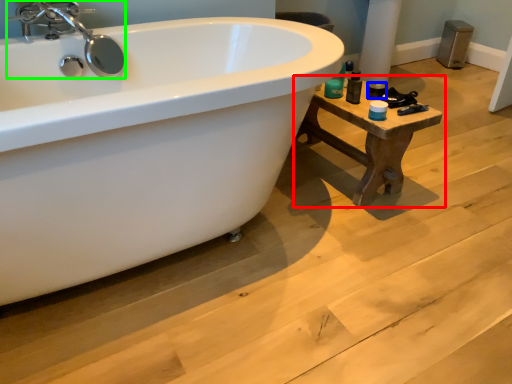
Question: Considering the real-world distances, which object is farthest from table (highlighted by a red box)? toiletry (highlighted by a blue box) or tap (highlighted by a green box)?

Choices:
 (A) toiletry
 (B) tap

Answer: (B)